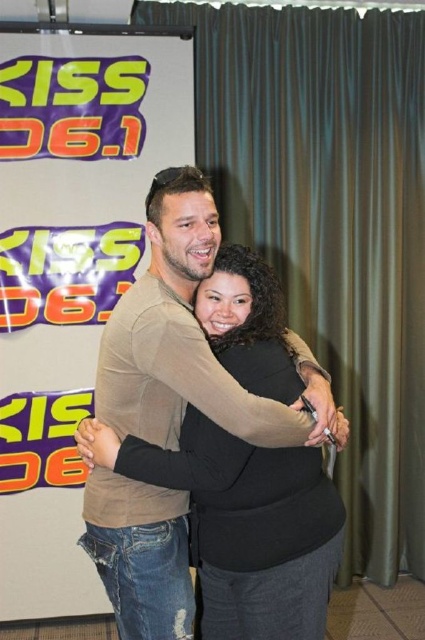
Does matte white banner at upper left appear on the left side of matte brown shirt at center?

Correct, you'll find matte white banner at upper left to the left of matte brown shirt at center.

Between matte white banner at upper left and matte brown shirt at center, which one appears on the left side from the viewer's perspective?

From the viewer's perspective, matte white banner at upper left appears more on the left side.

The image size is (425, 640). Find the location of `matte white banner at upper left`. matte white banner at upper left is located at coordinates (70, 268).

Based on the photo, which is below, matte green curtain at center or matte brown shirt at center?

matte brown shirt at center

Is point (254, 12) in front of point (127, 515)?

No, it is not.

Does point (382, 285) lie in front of point (82, 538)?

No.

Image resolution: width=425 pixels, height=640 pixels. Identify the location of matte green curtain at center. (331, 224).

Is matte green curtain at center thinner than matte white banner at upper left?

No, matte green curtain at center is not thinner than matte white banner at upper left.

Where is `matte green curtain at center`? matte green curtain at center is located at coordinates (331, 224).